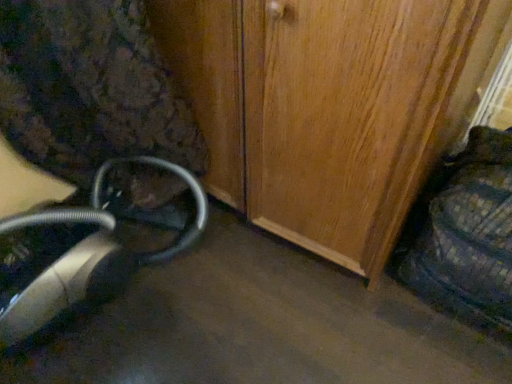
Question: From a real-world perspective, is metallic silver vacuum cleaner at lower left located higher than plaid fabric swivel chair at right?

Choices:
 (A) yes
 (B) no

Answer: (B)

Question: Does metallic silver vacuum cleaner at lower left come behind plaid fabric swivel chair at right?

Choices:
 (A) yes
 (B) no

Answer: (A)

Question: Does metallic silver vacuum cleaner at lower left have a smaller size compared to plaid fabric swivel chair at right?

Choices:
 (A) no
 (B) yes

Answer: (A)

Question: Is plaid fabric swivel chair at right surrounded by metallic silver vacuum cleaner at lower left?

Choices:
 (A) yes
 (B) no

Answer: (B)

Question: Is metallic silver vacuum cleaner at lower left facing away from plaid fabric swivel chair at right?

Choices:
 (A) no
 (B) yes

Answer: (A)

Question: Does metallic silver vacuum cleaner at lower left have a lesser height compared to plaid fabric swivel chair at right?

Choices:
 (A) no
 (B) yes

Answer: (B)

Question: Does plaid fabric swivel chair at right appear on the right side of metallic silver vacuum cleaner at lower left?

Choices:
 (A) no
 (B) yes

Answer: (B)

Question: Is plaid fabric swivel chair at right shorter than metallic silver vacuum cleaner at lower left?

Choices:
 (A) yes
 (B) no

Answer: (B)

Question: From a real-world perspective, is plaid fabric swivel chair at right below metallic silver vacuum cleaner at lower left?

Choices:
 (A) no
 (B) yes

Answer: (A)

Question: Is plaid fabric swivel chair at right bigger than metallic silver vacuum cleaner at lower left?

Choices:
 (A) no
 (B) yes

Answer: (A)

Question: Does plaid fabric swivel chair at right have a smaller size compared to metallic silver vacuum cleaner at lower left?

Choices:
 (A) no
 (B) yes

Answer: (B)

Question: Would you say metallic silver vacuum cleaner at lower left is part of plaid fabric swivel chair at right's contents?

Choices:
 (A) yes
 (B) no

Answer: (B)

Question: In terms of size, does metallic silver vacuum cleaner at lower left appear bigger or smaller than plaid fabric swivel chair at right?

Choices:
 (A) small
 (B) big

Answer: (B)